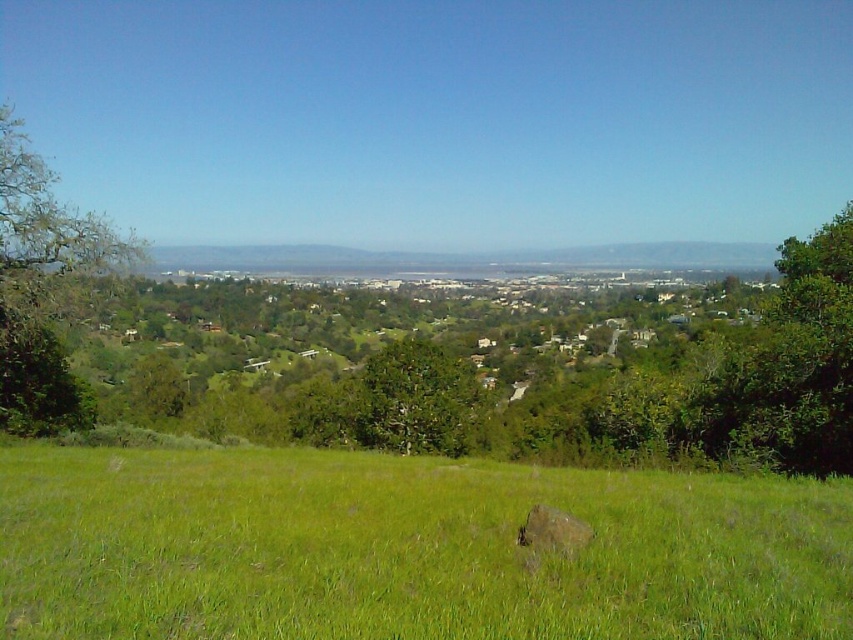
Question: Estimate the real-world distances between objects in this image. Which object is farther from the green grassy field at center?

Choices:
 (A) green leafy tree at left
 (B) brown rough rock at center

Answer: (A)

Question: Which of the following is the farthest from the observer?

Choices:
 (A) brown rough rock at center
 (B) green leafy tree at center

Answer: (B)

Question: Is green leafy tree at left behind brown rough rock at center?

Choices:
 (A) yes
 (B) no

Answer: (A)

Question: Does green leafy tree at left appear under brown rough rock at center?

Choices:
 (A) yes
 (B) no

Answer: (B)

Question: Among these points, which one is farthest from the camera?

Choices:
 (A) (57, 360)
 (B) (434, 483)

Answer: (A)

Question: Does green leafy tree at left have a smaller size compared to brown rough rock at center?

Choices:
 (A) no
 (B) yes

Answer: (A)